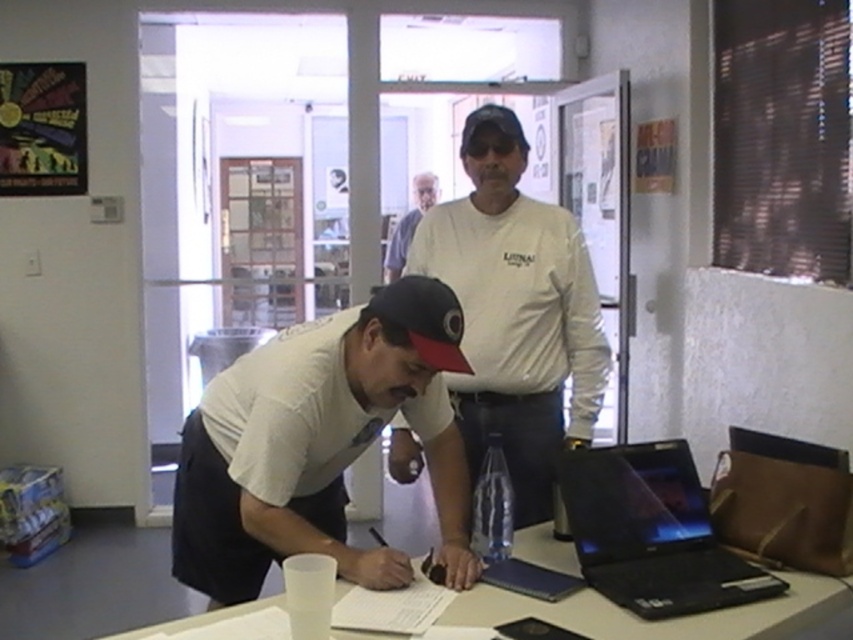
You are a customer entering this office and need to determine which employee is closer to the entrance. Based on the positions of the white matte shirt at center and the white cotton shirt at upper center, which one is positioned closer to the entrance?

The white matte shirt at center is not as tall as white cotton shirt at upper center, but this detail about height does not indicate their positions relative to the entrance. Without additional spatial information about their distance from the entrance, it is impossible to determine which is closer.

You are organizing a photoshoot and need to ensure that the white matte shirt at center and the white matte table at center are clearly visible in the frame. Given their sizes, which object should you focus on first to ensure it fits within the camera frame?

The white matte shirt at center is larger in size than the white matte table at center, so you should focus on the white matte shirt at center first to ensure it fits within the camera frame.

You are standing in the office and want to place a small object on the desk. There are two points marked on the desk at coordinates point (589, 612) and point (415, 276). Which point is closer to you?

Point (589, 612) is closer to the viewer than point (415, 276), so you should place the object there if you want it nearer to you.